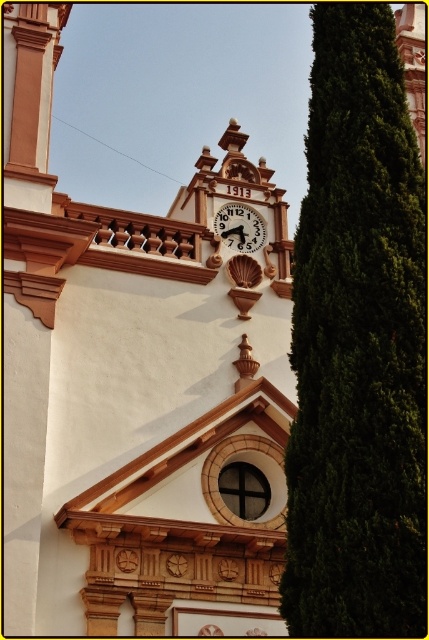
You are an architect inspecting the building facade. You notice the white stone clock at upper center and the wooden clock at center. Which clock is located to the left of the other?

The white stone clock at upper center is positioned on the left side of wooden clock at center.

You are an architect examining the building facade. You need to determine if the green leafy tree at right can be placed in front of the wooden clock at center without blocking it. Based on their widths, will the tree fit without obscuring the clock?

The green leafy tree at right is wider than the wooden clock at center. Since the tree is wider, placing it in front of the clock would likely block the entire clock face, making it impossible to view or access the wooden clock at center without moving the tree.